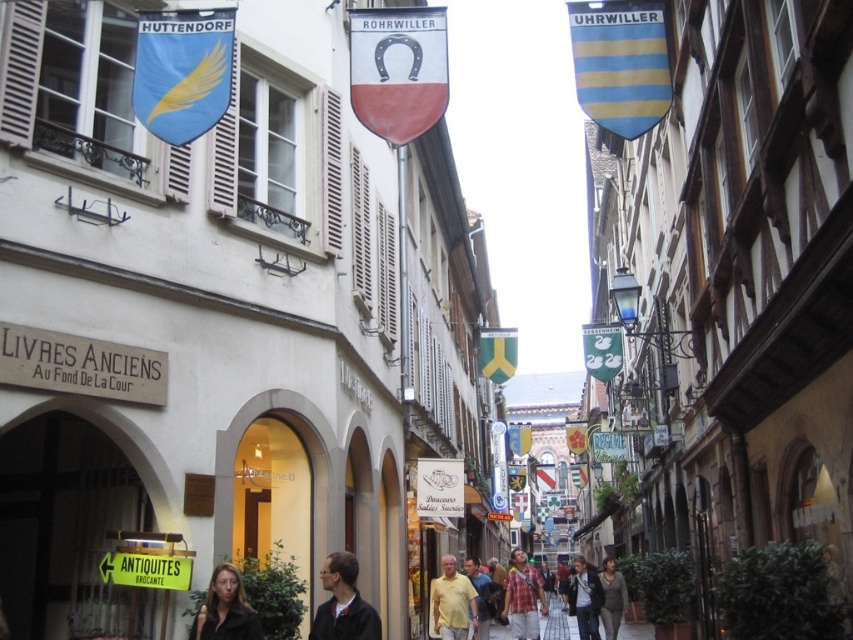
Is white fabric flag at center thinner than blue fabric flag with golden feather at upper left?

No.

Who is more forward, (349,93) or (157,61)?

Point (157,61)

Where is `white fabric flag at center`? The image size is (853, 640). white fabric flag at center is located at coordinates (398, 68).

Between white fabric flag at center and yellow fabric flag at center, which one has less height?

Standing shorter between the two is yellow fabric flag at center.

Image resolution: width=853 pixels, height=640 pixels. Describe the element at coordinates (398, 68) in the screenshot. I see `white fabric flag at center` at that location.

Image resolution: width=853 pixels, height=640 pixels. Identify the location of white fabric flag at center. (398, 68).

Between blue striped shield at upper right and green fabric swan at center, which one appears on the right side from the viewer's perspective?

Positioned to the right is green fabric swan at center.

Locate an element on the screen. The width and height of the screenshot is (853, 640). blue striped shield at upper right is located at coordinates (619, 64).

Is point (640, 122) farther from camera compared to point (614, 371)?

No, (640, 122) is in front of (614, 371).

Image resolution: width=853 pixels, height=640 pixels. What are the coordinates of `blue striped shield at upper right` in the screenshot? It's located at (619, 64).